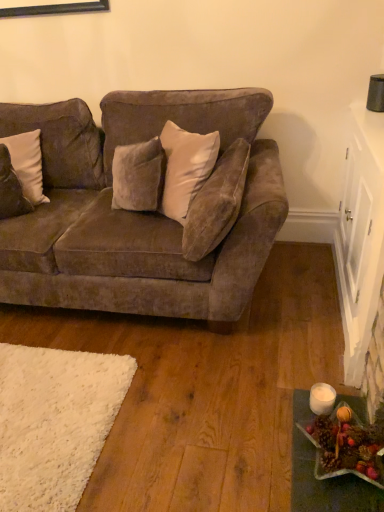
Question: From a real-world perspective, is velvet brown couch at left located beneath velvet beige pillow at center, the 1th pillow in the right-to-left sequence?

Choices:
 (A) yes
 (B) no

Answer: (A)

Question: Is velvet beige pillow at center, the 1th pillow in the right-to-left sequence, completely or partially inside velvet brown couch at left?

Choices:
 (A) no
 (B) yes

Answer: (B)

Question: From the image's perspective, is velvet brown couch at left on velvet beige pillow at center, which is the second pillow from left to right?

Choices:
 (A) no
 (B) yes

Answer: (B)

Question: Is velvet brown couch at left positioned beyond the bounds of velvet beige pillow at center, which is the second pillow from left to right?

Choices:
 (A) yes
 (B) no

Answer: (A)

Question: Is velvet brown couch at left oriented away from velvet beige pillow at center, the 1th pillow in the right-to-left sequence?

Choices:
 (A) yes
 (B) no

Answer: (B)

Question: Is the position of velvet brown couch at left less distant than that of velvet beige pillow at center, the 1th pillow in the right-to-left sequence?

Choices:
 (A) no
 (B) yes

Answer: (B)

Question: Considering the relative sizes of velvet brown couch at left and shiny metallic star at lower right in the image provided, is velvet brown couch at left thinner than shiny metallic star at lower right?

Choices:
 (A) no
 (B) yes

Answer: (A)

Question: Is velvet brown couch at left taller than shiny metallic star at lower right?

Choices:
 (A) yes
 (B) no

Answer: (A)

Question: Is velvet brown couch at left at the right side of shiny metallic star at lower right?

Choices:
 (A) yes
 (B) no

Answer: (B)

Question: Is velvet brown couch at left looking in the opposite direction of shiny metallic star at lower right?

Choices:
 (A) no
 (B) yes

Answer: (A)

Question: From a real-world perspective, does velvet brown couch at left stand above shiny metallic star at lower right?

Choices:
 (A) no
 (B) yes

Answer: (B)

Question: Can shiny metallic star at lower right be found inside velvet brown couch at left?

Choices:
 (A) yes
 (B) no

Answer: (B)

Question: Considering the relative sizes of shiny metallic star at lower right and velvet beige pillow at center, which is the second pillow from left to right, in the image provided, is shiny metallic star at lower right smaller than velvet beige pillow at center, which is the second pillow from left to right,?

Choices:
 (A) yes
 (B) no

Answer: (A)